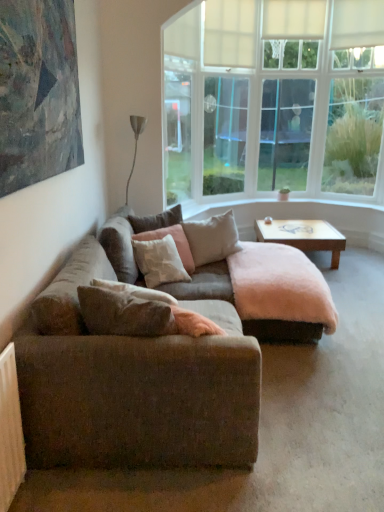
Question: Is wooden at center thinner than white soft pillow at center, which is the 2th pillow in front-to-back order?

Choices:
 (A) no
 (B) yes

Answer: (A)

Question: Does wooden at center appear on the left side of white soft pillow at center, the third pillow viewed from the back?

Choices:
 (A) no
 (B) yes

Answer: (A)

Question: Considering the relative positions of wooden at center and white soft pillow at center, which is the 2th pillow in front-to-back order, in the image provided, is wooden at center to the right of white soft pillow at center, which is the 2th pillow in front-to-back order, from the viewer's perspective?

Choices:
 (A) yes
 (B) no

Answer: (A)

Question: From the image's perspective, would you say wooden at center is positioned over white soft pillow at center, which is the 2th pillow in front-to-back order?

Choices:
 (A) no
 (B) yes

Answer: (B)

Question: Is wooden at center oriented towards white soft pillow at center, which is the 2th pillow in front-to-back order?

Choices:
 (A) yes
 (B) no

Answer: (B)

Question: From a real-world perspective, relative to beige fabric pillow at center, which is the second pillow from back to front, is white soft pillow at center, which is the 2th pillow in front-to-back order, vertically above or below?

Choices:
 (A) below
 (B) above

Answer: (A)

Question: Is white soft pillow at center, which is the 2th pillow in front-to-back order, situated inside beige fabric pillow at center, which appears as the 3th pillow when viewed from the front, or outside?

Choices:
 (A) outside
 (B) inside

Answer: (A)

Question: Is point (162, 251) closer or farther from the camera than point (203, 262)?

Choices:
 (A) farther
 (B) closer

Answer: (B)

Question: Would you say white soft pillow at center, which is the 2th pillow in front-to-back order, is to the left or to the right of beige fabric pillow at center, which appears as the 3th pillow when viewed from the front, in the picture?

Choices:
 (A) right
 (B) left

Answer: (B)

Question: In the image, is wooden at center positioned in front of or behind white soft pillow at center, the third pillow viewed from the back?

Choices:
 (A) front
 (B) behind

Answer: (B)

Question: From the image's perspective, is wooden at center above or below white soft pillow at center, which is the 2th pillow in front-to-back order?

Choices:
 (A) below
 (B) above

Answer: (B)

Question: Is wooden at center taller or shorter than white soft pillow at center, which is the 2th pillow in front-to-back order?

Choices:
 (A) short
 (B) tall

Answer: (A)

Question: Does point (284, 234) appear closer or farther from the camera than point (132, 246)?

Choices:
 (A) farther
 (B) closer

Answer: (A)

Question: From a real-world perspective, relative to textured canvas painting at upper left, is textured brown couch at center vertically above or below?

Choices:
 (A) below
 (B) above

Answer: (A)

Question: From the image's perspective, is textured brown couch at center located above or below textured canvas painting at upper left?

Choices:
 (A) above
 (B) below

Answer: (B)